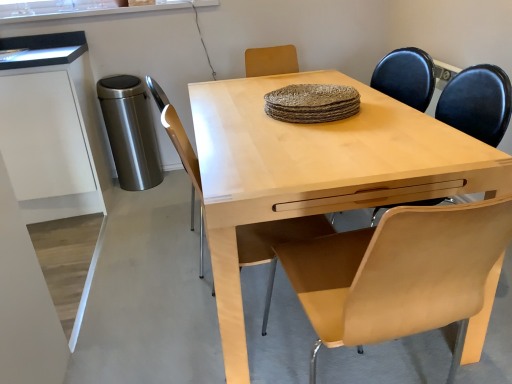
Identify the location of vacant region above light wood desk at center (from a real-world perspective). This screenshot has height=384, width=512. (285, 123).